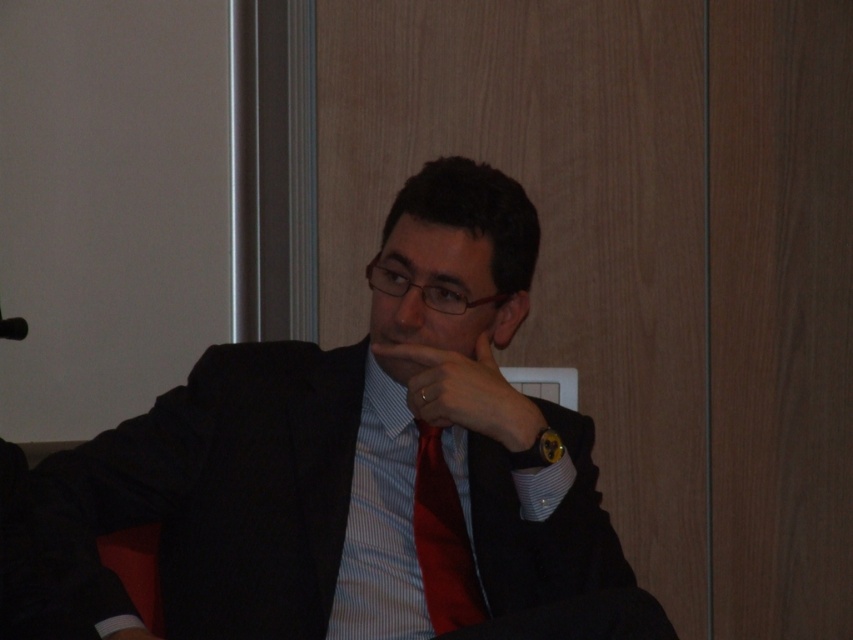
Question: Is light blue striped dress shirt at center behind red satin tie at center?

Choices:
 (A) no
 (B) yes

Answer: (A)

Question: Which object is the closest to the matte glass nose at center?

Choices:
 (A) matte black hand at center
 (B) red satin tie at center
 (C) light blue striped dress shirt at center
 (D) black suit at center

Answer: (A)

Question: Estimate the real-world distances between objects in this image. Which object is farther from the black suit at center?

Choices:
 (A) matte glass nose at center
 (B) matte black hand at center
 (C) red satin tie at center
 (D) light blue striped dress shirt at center

Answer: (A)

Question: Does red satin tie at center have a lesser width compared to matte glass nose at center?

Choices:
 (A) yes
 (B) no

Answer: (B)

Question: Is light blue striped dress shirt at center smaller than red satin tie at center?

Choices:
 (A) no
 (B) yes

Answer: (A)

Question: Estimate the real-world distances between objects in this image. Which object is closer to the matte glass nose at center?

Choices:
 (A) matte black hand at center
 (B) red satin tie at center
 (C) black suit at center
 (D) light blue striped dress shirt at center

Answer: (A)